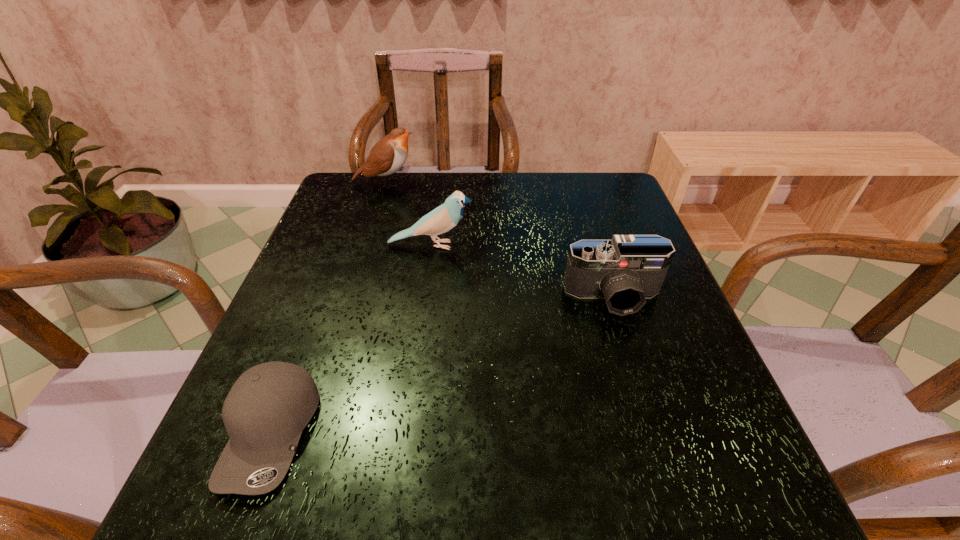
This screenshot has width=960, height=540. I want to click on object that is at the near edge, so click(266, 410).

I want to click on bird that is at the left edge, so click(x=387, y=156).

Locate an element on the screen. This screenshot has width=960, height=540. baseball cap located in the left edge section of the desktop is located at coordinates (266, 410).

Identify the location of object at the right edge. The image size is (960, 540). (625, 270).

Locate an element on the screen. object located at the far left corner is located at coordinates (387, 156).

Where is `object positioned at the near left corner`? The image size is (960, 540). object positioned at the near left corner is located at coordinates (266, 410).

At what (x,y) coordinates should I click in order to perform the action: click on free spot at the far edge of the desktop. Please return your answer as a coordinate pair (x, y). This screenshot has width=960, height=540. Looking at the image, I should click on (441, 193).

Locate an element on the screen. The width and height of the screenshot is (960, 540). vacant region at the near edge of the desktop is located at coordinates (605, 507).

This screenshot has height=540, width=960. Identify the location of blank space at the left edge. (334, 284).

Locate an element on the screen. Image resolution: width=960 pixels, height=540 pixels. vacant space at the right edge of the desktop is located at coordinates (642, 312).